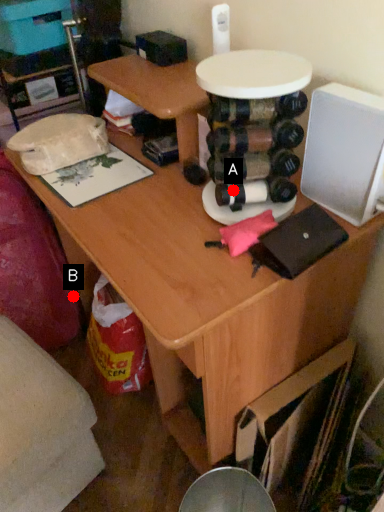
Question: Two points are circled on the image, labeled by A and B beside each circle. Which point appears closest to the camera in this image?

Choices:
 (A) A is closer
 (B) B is closer

Answer: (A)